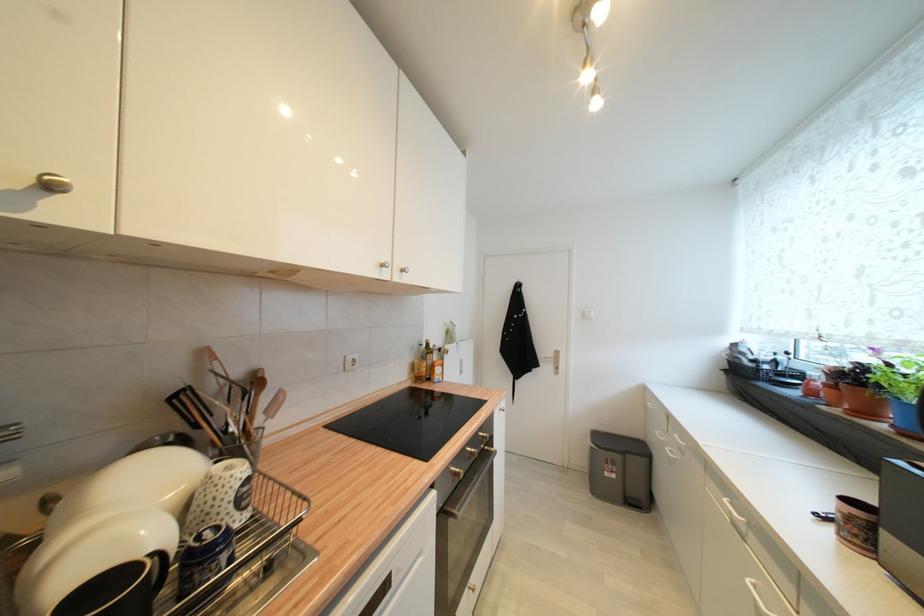
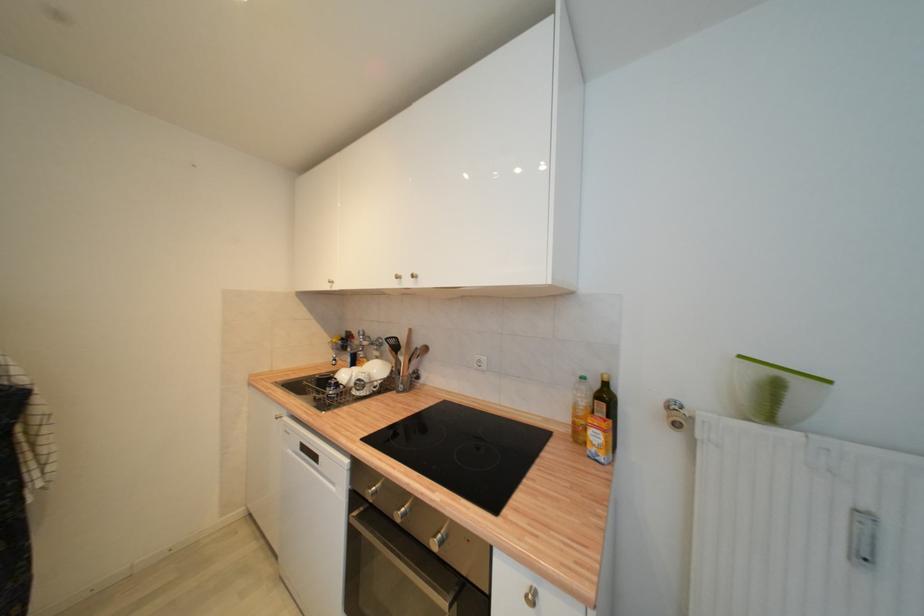
Locate, in the second image, the point that corresponds to the point at 426,347 in the first image.

(586, 379)